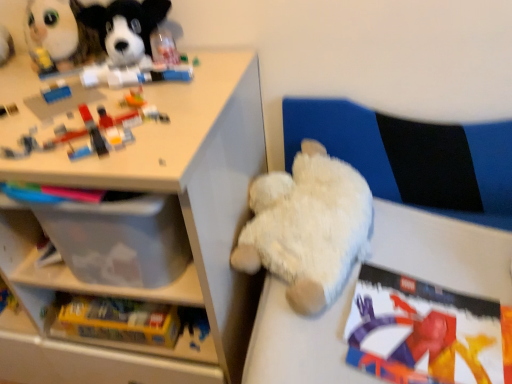
Question: From the image's perspective, is fluffy white plush at upper left, which is the 4th toy in right-to-left order, on matte plastic book at lower right?

Choices:
 (A) no
 (B) yes

Answer: (B)

Question: Is fluffy white plush at upper left, the first toy viewed from the left, looking in the opposite direction of matte plastic book at lower right?

Choices:
 (A) no
 (B) yes

Answer: (A)

Question: Is fluffy white plush at upper left, which is the 4th toy in right-to-left order, outside matte plastic book at lower right?

Choices:
 (A) yes
 (B) no

Answer: (A)

Question: Is fluffy white plush at upper left, which is the 4th toy in right-to-left order, wider than matte plastic book at lower right?

Choices:
 (A) yes
 (B) no

Answer: (B)

Question: Are fluffy white plush at upper left, which is the 4th toy in right-to-left order, and matte plastic book at lower right making contact?

Choices:
 (A) no
 (B) yes

Answer: (A)

Question: Is white plastic shelf at upper left taller or shorter than brick-like plastic toys at upper left, the second toy in the left-to-right sequence?

Choices:
 (A) short
 (B) tall

Answer: (B)

Question: Does point (184, 180) appear closer or farther from the camera than point (83, 130)?

Choices:
 (A) closer
 (B) farther

Answer: (A)

Question: Looking at their shapes, would you say white plastic shelf at upper left is wider or thinner than brick-like plastic toys at upper left, the second toy in the left-to-right sequence?

Choices:
 (A) thin
 (B) wide

Answer: (B)

Question: From a real-world perspective, is white plastic shelf at upper left physically located above or below brick-like plastic toys at upper left, the second toy in the left-to-right sequence?

Choices:
 (A) above
 (B) below

Answer: (B)

Question: Relative to fluffy white plush at upper left, the first toy viewed from the left, is brick-like plastic toys at upper left, the third toy viewed from the right, in front or behind?

Choices:
 (A) behind
 (B) front

Answer: (B)

Question: Do you think brick-like plastic toys at upper left, the second toy in the left-to-right sequence, is within fluffy white plush at upper left, the first toy viewed from the left, or outside of it?

Choices:
 (A) outside
 (B) inside

Answer: (A)

Question: From a real-world perspective, is brick-like plastic toys at upper left, the second toy in the left-to-right sequence, positioned above or below fluffy white plush at upper left, which is the 4th toy in right-to-left order?

Choices:
 (A) below
 (B) above

Answer: (A)

Question: Considering the positions of brick-like plastic toys at upper left, the third toy viewed from the right, and fluffy white plush at upper left, which is the 4th toy in right-to-left order, in the image, is brick-like plastic toys at upper left, the third toy viewed from the right, taller or shorter than fluffy white plush at upper left, which is the 4th toy in right-to-left order,?

Choices:
 (A) short
 (B) tall

Answer: (A)

Question: Does point (464, 352) appear closer or farther from the camera than point (178, 160)?

Choices:
 (A) closer
 (B) farther

Answer: (B)

Question: From a real-world perspective, is matte plastic book at lower right physically located above or below white plastic shelf at upper left?

Choices:
 (A) above
 (B) below

Answer: (B)